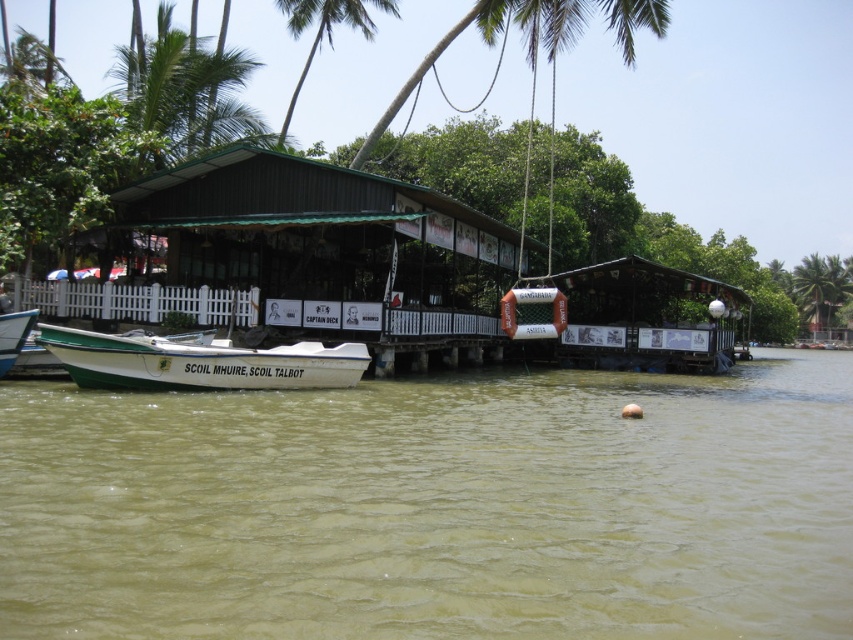
Question: Can you confirm if green leafy palm tree at upper right is positioned below white matte boat at lower left?

Choices:
 (A) yes
 (B) no

Answer: (B)

Question: Which point is farther to the camera?

Choices:
 (A) white matte boat at lower left
 (B) green leafy palm tree at upper left
 (C) white matte boat at center
 (D) green leafy palm tree at upper center

Answer: (D)

Question: Which of the following is the farthest from the observer?

Choices:
 (A) (491, 241)
 (B) (828, 260)

Answer: (B)

Question: Is green leafy palm tree at upper left to the right of white matte boat at lower left from the viewer's perspective?

Choices:
 (A) yes
 (B) no

Answer: (B)

Question: Can you confirm if white matte boat at center is positioned to the left of green leafy palm tree at upper left?

Choices:
 (A) yes
 (B) no

Answer: (B)

Question: Which object appears farthest from the camera in this image?

Choices:
 (A) brown wooden hut at center
 (B) white matte boat at center

Answer: (A)